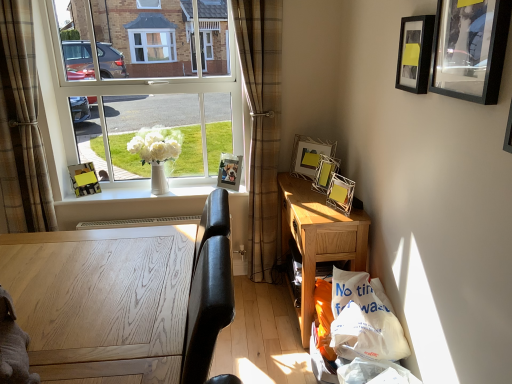
Locate an element on the screen. empty space that is ontop of brown plaid curtain at center, the first curtain viewed from the right (from a real-world perspective) is located at coordinates coord(254,0).